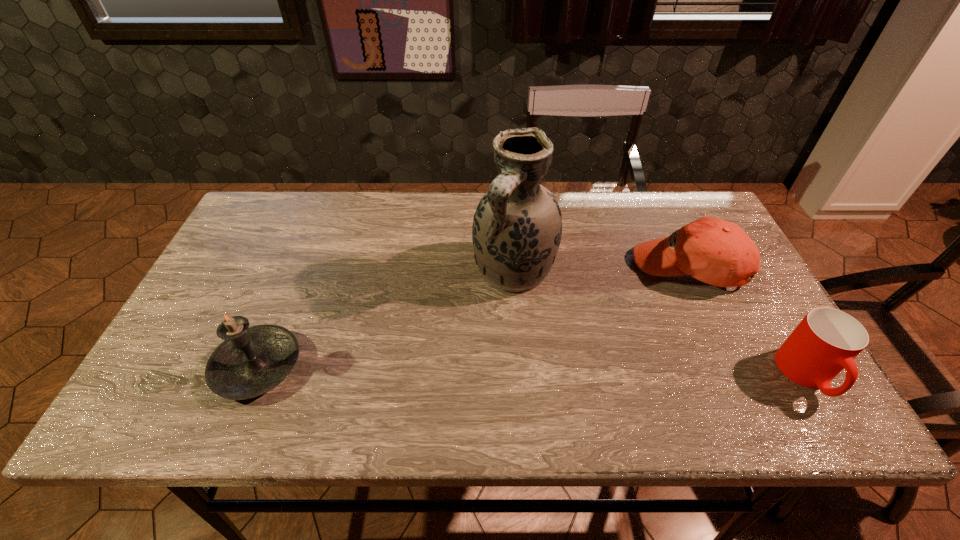
Image resolution: width=960 pixels, height=540 pixels. Find the location of `vacant space situated on the front-facing side of the baseball cap`. vacant space situated on the front-facing side of the baseball cap is located at coordinates (591, 339).

The image size is (960, 540). In order to click on vacant space located 0.080m on the front-facing side of the baseball cap in this screenshot , I will do `click(636, 302)`.

Identify the location of vacant space located on the front-facing side of the baseball cap. The image size is (960, 540). (619, 316).

Locate an element on the screen. The height and width of the screenshot is (540, 960). candle that is positioned at the near edge is located at coordinates (251, 361).

Find the location of `cup at the near edge`. cup at the near edge is located at coordinates (826, 341).

Where is `object at the left edge`? Image resolution: width=960 pixels, height=540 pixels. object at the left edge is located at coordinates (251, 361).

Image resolution: width=960 pixels, height=540 pixels. I want to click on cup present at the right edge, so click(826, 341).

Image resolution: width=960 pixels, height=540 pixels. Identify the location of baseball cap that is at the right edge. (717, 252).

Where is `object that is at the near left corner`? This screenshot has height=540, width=960. object that is at the near left corner is located at coordinates (251, 361).

This screenshot has height=540, width=960. I want to click on object located in the near right corner section of the desktop, so click(x=826, y=341).